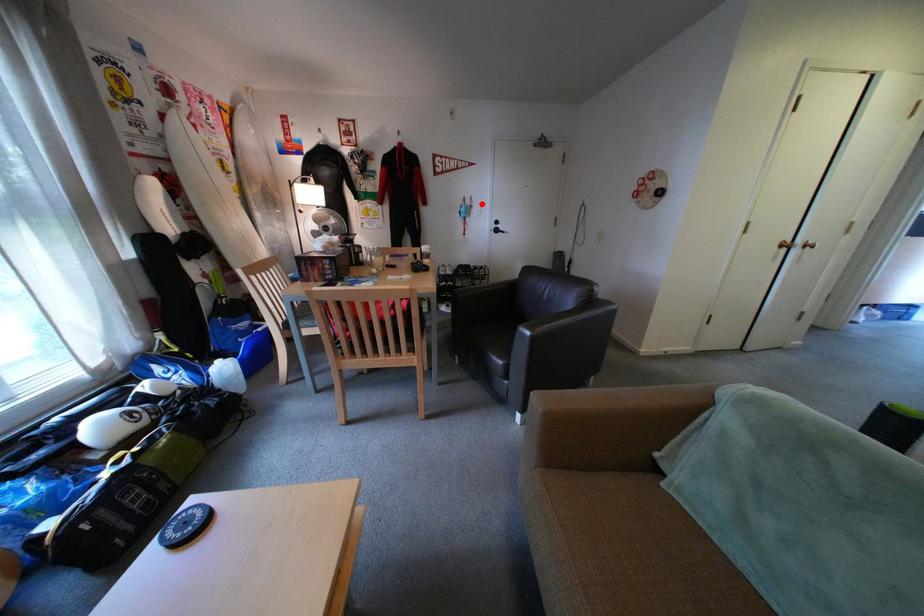
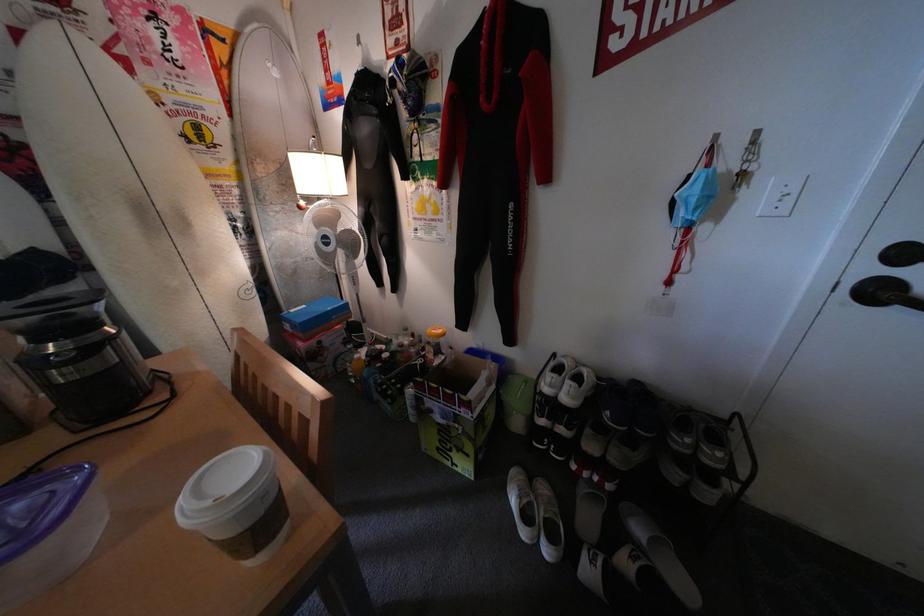
Question: A red point is marked in image1. In image2, is the corresponding 3D point closer to the camera or farther? Reply with the corresponding letter.

Choices:
 (A) The corresponding 3D point is closer.
 (B) The corresponding 3D point is farther.

Answer: (B)